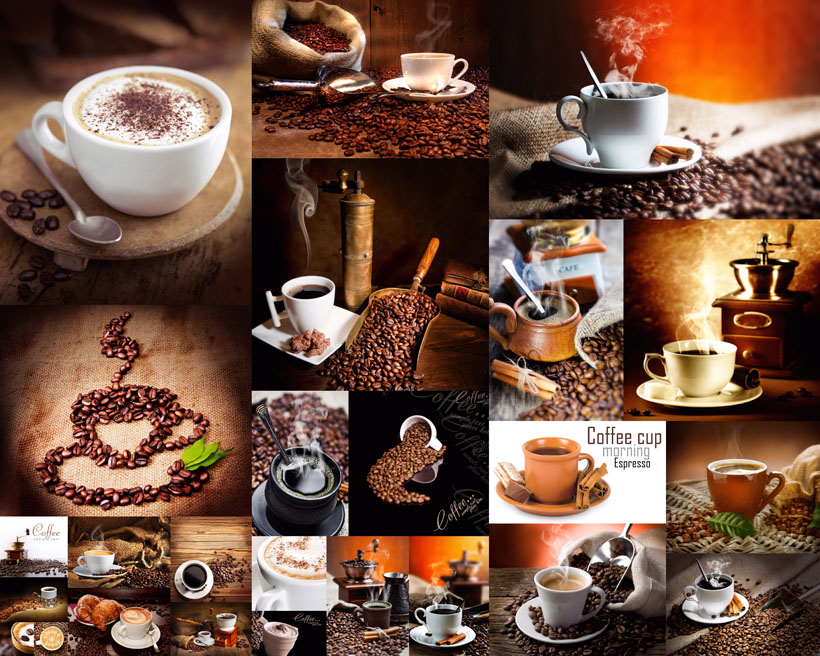
At what (x,y) coordinates should I click in order to perform the action: click on foam. Please return your answer as a coordinate pair (x, y). This screenshot has height=656, width=820. Looking at the image, I should click on (288, 561), (46, 529), (19, 634), (285, 625).